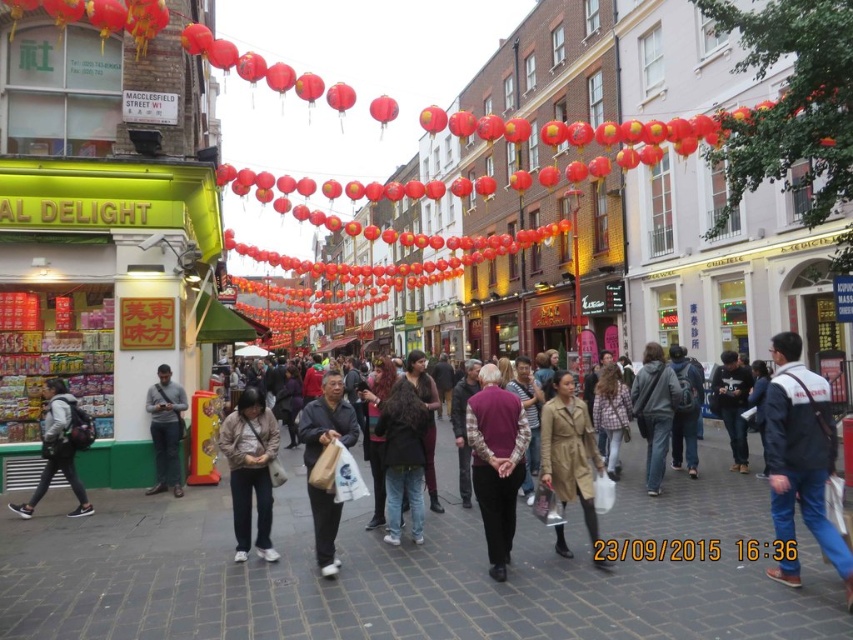
Question: Which point is farther to the camera?

Choices:
 (A) (349, 436)
 (B) (659, 420)
 (C) (178, 422)
 (D) (239, 483)

Answer: (C)

Question: Is brown brick pavement at center positioned in front of brown paper bag at center?

Choices:
 (A) no
 (B) yes

Answer: (B)

Question: Can you confirm if purple woolen vest at center is positioned above brown paper bag at center?

Choices:
 (A) yes
 (B) no

Answer: (A)

Question: Which of the following is the farthest from the observer?

Choices:
 (A) (44, 472)
 (B) (329, 531)
 (C) (697, 458)
 (D) (412, 468)

Answer: (C)

Question: Among these points, which one is nearest to the camera?

Choices:
 (A) (781, 580)
 (B) (306, 422)
 (C) (155, 412)
 (D) (233, 497)

Answer: (A)

Question: In this image, where is black matte jacket at center located relative to matte black backpack at center?

Choices:
 (A) below
 (B) above

Answer: (A)